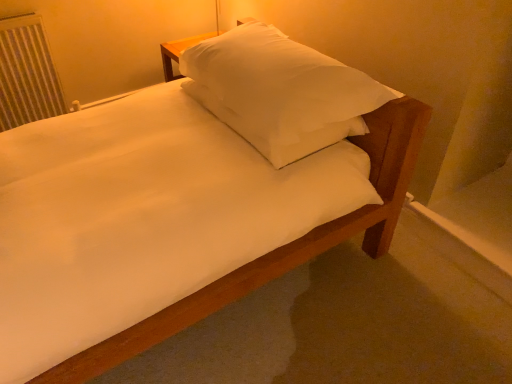
Describe the element at coordinates (27, 74) in the screenshot. This screenshot has height=384, width=512. I see `white painted metal radiator at left` at that location.

The width and height of the screenshot is (512, 384). I want to click on white painted metal radiator at left, so click(27, 74).

What do you see at coordinates (280, 82) in the screenshot? The image size is (512, 384). I see `white soft pillow at upper center` at bounding box center [280, 82].

Locate an element on the screen. This screenshot has height=384, width=512. white soft pillow at upper center is located at coordinates (280, 82).

Locate an element on the screen. Image resolution: width=512 pixels, height=384 pixels. white painted metal radiator at left is located at coordinates (27, 74).

Based on the photo, considering the relative positions of white painted metal radiator at left and white soft pillow at upper center in the image provided, is white painted metal radiator at left to the right of white soft pillow at upper center from the viewer's perspective?

Incorrect, white painted metal radiator at left is not on the right side of white soft pillow at upper center.

Which is in front, white painted metal radiator at left or white soft pillow at upper center?

white soft pillow at upper center.

Considering the positions of points (20, 24) and (296, 106), is point (20, 24) farther from camera compared to point (296, 106)?

Yes, it is.

From the image's perspective, which one is positioned lower, white painted metal radiator at left or white soft pillow at upper center?

white soft pillow at upper center.

From a real-world perspective, relative to white soft pillow at upper center, is white painted metal radiator at left vertically above or below?

From a real-world perspective, white painted metal radiator at left is physically below white soft pillow at upper center.

In terms of width, does white painted metal radiator at left look wider or thinner when compared to white soft pillow at upper center?

In the image, white painted metal radiator at left appears to be more narrow than white soft pillow at upper center.

Considering the sizes of white painted metal radiator at left and white soft pillow at upper center in the image, is white painted metal radiator at left taller or shorter than white soft pillow at upper center?

Clearly, white painted metal radiator at left is taller compared to white soft pillow at upper center.

Considering the sizes of objects white painted metal radiator at left and white soft pillow at upper center in the image provided, who is bigger, white painted metal radiator at left or white soft pillow at upper center?

white soft pillow at upper center.

Would you say white painted metal radiator at left is inside or outside white soft pillow at upper center?

white painted metal radiator at left is not inside white soft pillow at upper center, it's outside.

Does white painted metal radiator at left touch white soft pillow at upper center?

There is a gap between white painted metal radiator at left and white soft pillow at upper center.

Is white soft pillow at upper center at the back of white painted metal radiator at left?

white painted metal radiator at left is not turned away from white soft pillow at upper center.

At what (x,y) coordinates should I click in order to perform the action: click on pillow that appears below the white painted metal radiator at left (from the image's perspective). Please return your answer as a coordinate pair (x, y). The width and height of the screenshot is (512, 384). Looking at the image, I should click on (280, 82).

Is white soft pillow at upper center to the left of white painted metal radiator at left from the viewer's perspective?

In fact, white soft pillow at upper center is to the right of white painted metal radiator at left.

Is white soft pillow at upper center positioned before white painted metal radiator at left?

Yes.

Does point (382, 103) come in front of point (62, 112)?

Yes, it is in front of point (62, 112).

From the image's perspective, is white soft pillow at upper center on top of white painted metal radiator at left?

No, from the image's perspective, white soft pillow at upper center is not over white painted metal radiator at left.

From a real-world perspective, which is physically above, white soft pillow at upper center or white painted metal radiator at left?

In real-world perspective, white soft pillow at upper center is above.

Between white soft pillow at upper center and white painted metal radiator at left, which one has smaller width?

Thinner between the two is white painted metal radiator at left.

Which of these two, white soft pillow at upper center or white painted metal radiator at left, stands shorter?

With less height is white soft pillow at upper center.

Can you confirm if white soft pillow at upper center is smaller than white painted metal radiator at left?

Actually, white soft pillow at upper center might be larger than white painted metal radiator at left.

From the picture: Can we say white soft pillow at upper center lies outside white painted metal radiator at left?

white soft pillow at upper center lies outside white painted metal radiator at left's area.

Are white soft pillow at upper center and white painted metal radiator at left making contact?

No.

Is white soft pillow at upper center positioned with its back to white painted metal radiator at left?

Correct, white soft pillow at upper center is looking away from white painted metal radiator at left.

What's the angular difference between white soft pillow at upper center and white painted metal radiator at left's facing directions?

The facing directions of white soft pillow at upper center and white painted metal radiator at left are 66.8 degrees apart.

The image size is (512, 384). I want to click on radiator on the left of the white soft pillow at upper center, so click(27, 74).

The height and width of the screenshot is (384, 512). In order to click on pillow that appears on the right of white painted metal radiator at left in this screenshot , I will do `click(280, 82)`.

The width and height of the screenshot is (512, 384). I want to click on radiator located underneath the white soft pillow at upper center (from a real-world perspective), so click(x=27, y=74).